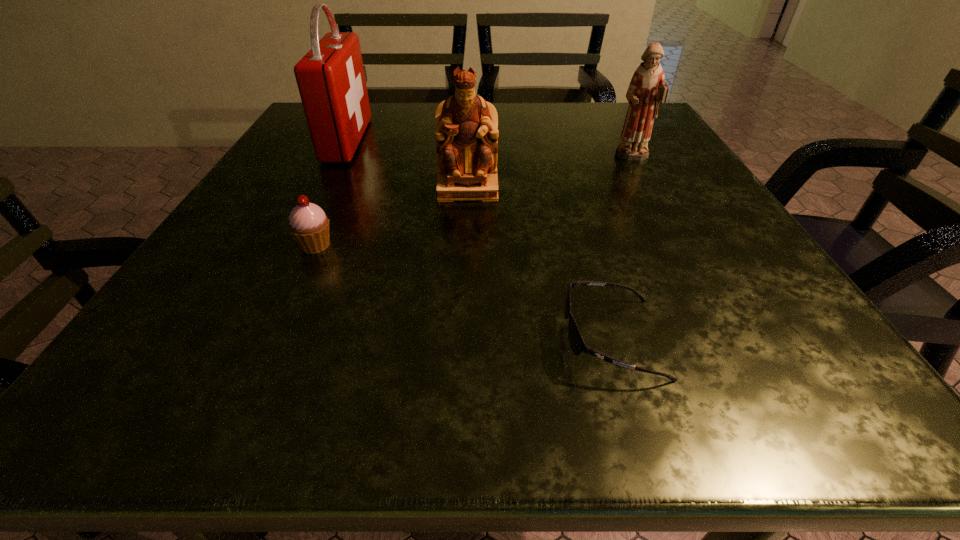
The width and height of the screenshot is (960, 540). What are the coordinates of `object at the right edge` in the screenshot? It's located at (647, 89).

Locate an element on the screen. The width and height of the screenshot is (960, 540). object at the far left corner is located at coordinates (331, 80).

Where is `vacant position at the far edge of the desktop`? The image size is (960, 540). vacant position at the far edge of the desktop is located at coordinates (574, 104).

You are a GUI agent. You are given a task and a screenshot of the screen. Output one action in this format:
    pyautogui.click(x=<x>, y=<y>)
    Task: Click on the vacant space at the near edge of the desktop
    The height and width of the screenshot is (540, 960).
    Given the screenshot: What is the action you would take?
    pyautogui.click(x=445, y=367)

Where is `vacant space at the left edge of the desktop`? The height and width of the screenshot is (540, 960). vacant space at the left edge of the desktop is located at coordinates (274, 233).

At what (x,y) coordinates should I click in order to perform the action: click on vacant space at the right edge of the desktop. Please return your answer as a coordinate pair (x, y). This screenshot has width=960, height=540. Looking at the image, I should click on (730, 253).

The height and width of the screenshot is (540, 960). I want to click on free space at the near left corner, so click(251, 372).

Identify the location of vacant space at the near right corner of the desktop. This screenshot has width=960, height=540. (837, 392).

In order to click on empty location between the cupcake and the right figurine in this screenshot , I will do `click(474, 202)`.

The width and height of the screenshot is (960, 540). In order to click on empty location between the third object from right to left and the fourth farthest object in this screenshot , I will do `click(392, 217)`.